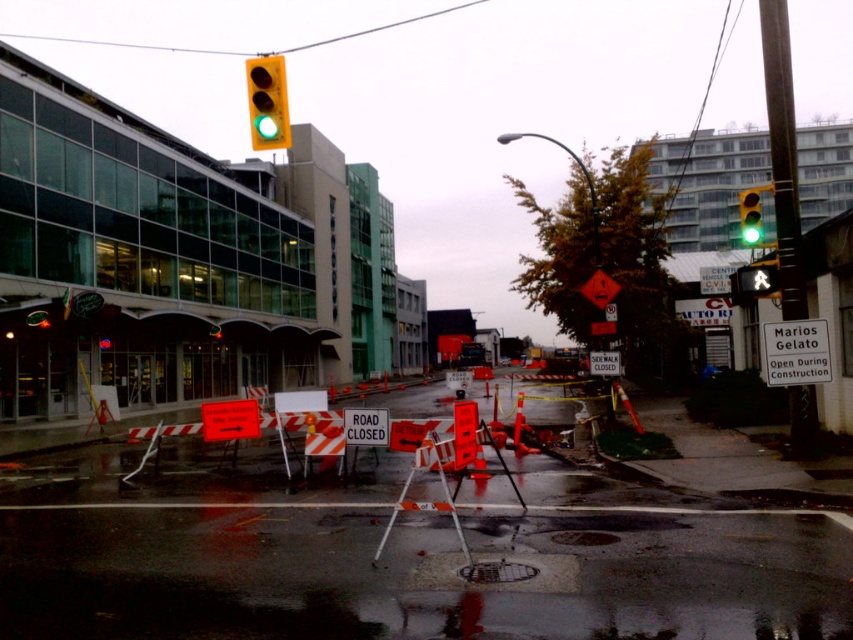
Question: Estimate the real-world distances between objects in this image. Which object is closer to the white paper sidewalk closed sign at center?

Choices:
 (A) white plastic road sign at center
 (B) green matte traffic light at upper center

Answer: (A)

Question: In this image, where is metallic pole at right located relative to white paper sidewalk closed sign at center?

Choices:
 (A) right
 (B) left

Answer: (A)

Question: Can you confirm if metallic pole at right is smaller than orange reflective road sign at center?

Choices:
 (A) yes
 (B) no

Answer: (B)

Question: Estimate the real-world distances between objects in this image. Which object is closer to the metallic pole at right?

Choices:
 (A) green matte traffic light at upper center
 (B) white plastic road sign at center
 (C) orange reflective road sign at center
 (D) orange plastic traffic cone at center

Answer: (D)

Question: Based on their relative distances, which object is nearer to the white paper sidewalk closed sign at center?

Choices:
 (A) orange reflective road sign at center
 (B) metallic pole at right
 (C) white plastic road sign at center

Answer: (B)

Question: Can you confirm if metallic pole at right is bigger than white plastic sign at center?

Choices:
 (A) yes
 (B) no

Answer: (A)